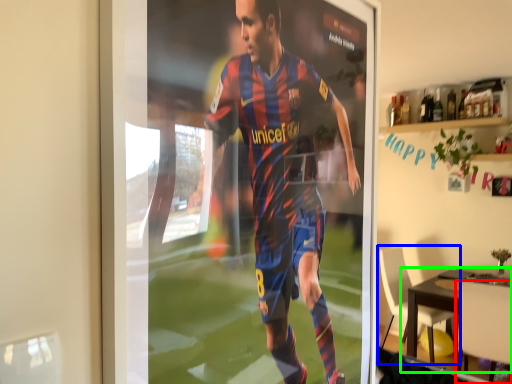
Question: Which object is positioned closest to chair (highlighted by a red box)? Select from chair (highlighted by a blue box) and table (highlighted by a green box).

Choices:
 (A) chair
 (B) table

Answer: (B)